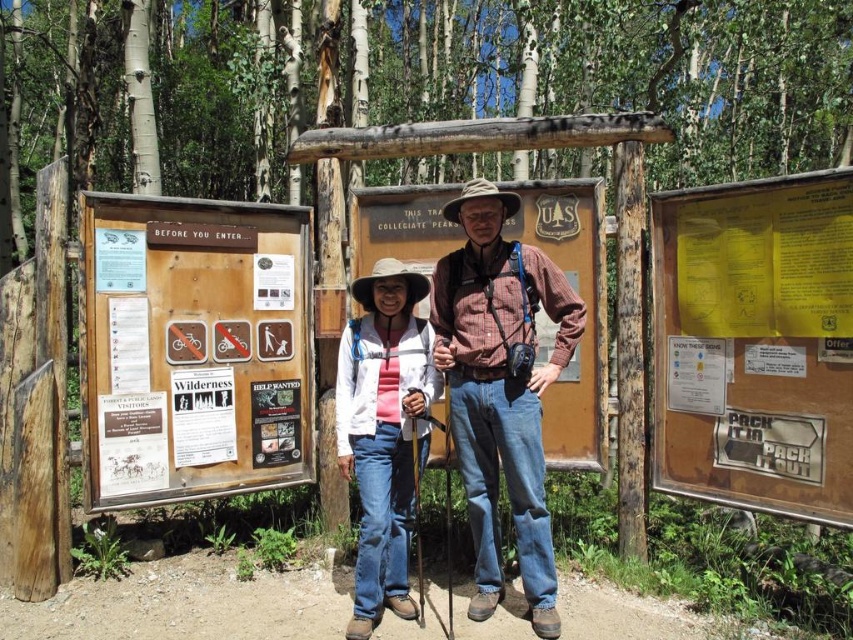
Does wooden sign at left have a larger size compared to plaid cotton shirt at center?

Incorrect, wooden sign at left is not larger than plaid cotton shirt at center.

Does wooden sign at left have a greater height compared to plaid cotton shirt at center?

No.

The width and height of the screenshot is (853, 640). In order to click on wooden sign at left in this screenshot , I will do `click(190, 349)`.

Is plaid cotton shirt at center closer to the viewer compared to white paper wilderness sign at center?

Yes, it is in front of white paper wilderness sign at center.

What are the coordinates of `plaid cotton shirt at center` in the screenshot? It's located at (502, 387).

Which of these two, wooden sign at left or white fabric cowboy hat at center, stands taller?

wooden sign at left

Based on the photo, which is above, wooden sign at left or white fabric cowboy hat at center?

Positioned higher is white fabric cowboy hat at center.

At what (x,y) coordinates should I click in order to perform the action: click on wooden sign at left. Please return your answer as a coordinate pair (x, y). Looking at the image, I should click on (190, 349).